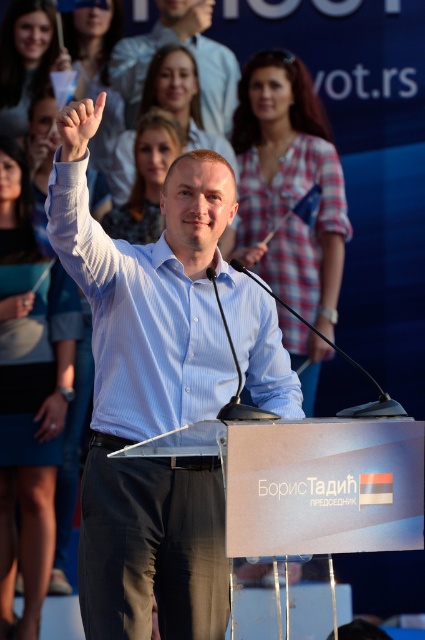
In the scene shown: Can you confirm if light blue shirt at center is taller than blue denim skirt at lower left?

Incorrect, light blue shirt at center's height is not larger of blue denim skirt at lower left's.

Which is behind, point (255, 388) or point (2, 420)?

The point (2, 420) is behind.

Identify the location of light blue shirt at center. The width and height of the screenshot is (425, 640). (159, 390).

Can you confirm if light blue shirt at center is positioned to the right of matte blue shirt at center?

Yes, light blue shirt at center is to the right of matte blue shirt at center.

Is light blue shirt at center behind matte blue shirt at center?

No, it is in front of matte blue shirt at center.

This screenshot has width=425, height=640. What are the coordinates of `light blue shirt at center` in the screenshot? It's located at (159, 390).

Find the location of `light blue shirt at center`. light blue shirt at center is located at coordinates (159, 390).

Who is lower down, plaid fabric shirt at upper center or blue denim skirt at lower left?

Positioned lower is blue denim skirt at lower left.

Locate an element on the screen. This screenshot has height=640, width=425. plaid fabric shirt at upper center is located at coordinates (289, 188).

Where is `plaid fabric shirt at upper center`? This screenshot has height=640, width=425. plaid fabric shirt at upper center is located at coordinates (289, 188).